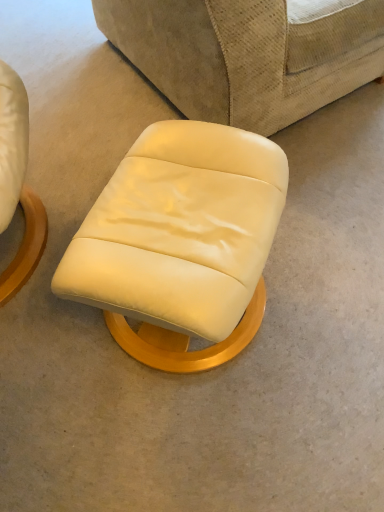
Identify the location of vacant area that lies to the right of matte cream leather ottoman at center. This screenshot has height=512, width=384. (324, 289).